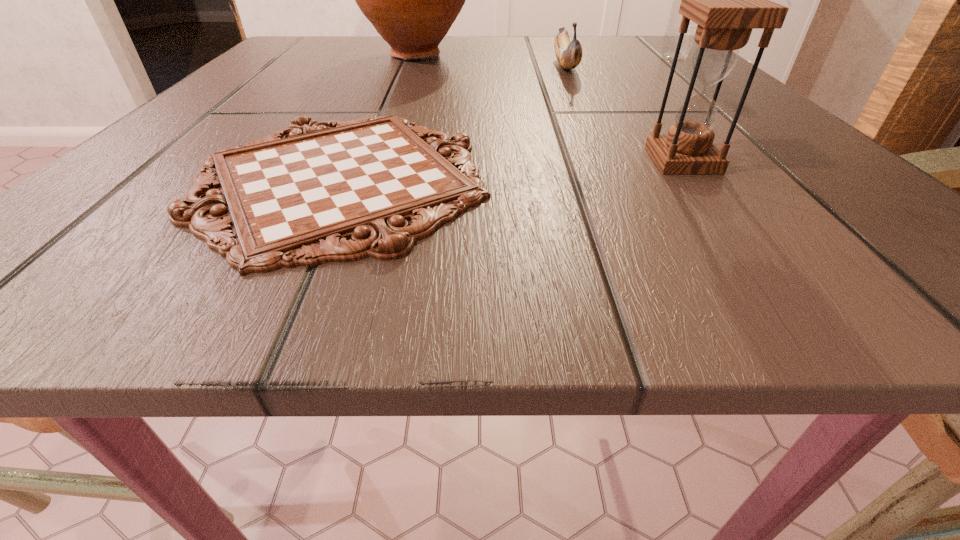
At what (x,y) coordinates should I click in order to perform the action: click on object that is positioned at the far right corner. Please return your answer as a coordinate pair (x, y). This screenshot has height=540, width=960. Looking at the image, I should click on (671, 36).

In the image, there is a desktop. Find the location of `vacant space at the far edge`. vacant space at the far edge is located at coordinates 379,39.

Where is `vacant region at the near edge of the desktop`? The image size is (960, 540). vacant region at the near edge of the desktop is located at coordinates [x=584, y=245].

The height and width of the screenshot is (540, 960). What are the coordinates of `free space at the left edge of the desktop` in the screenshot? It's located at (186, 148).

Locate an element on the screen. Image resolution: width=960 pixels, height=540 pixels. vacant point at the right edge is located at coordinates (744, 120).

The height and width of the screenshot is (540, 960). Identify the location of vacant space at the far left corner of the desktop. (295, 43).

At what (x,y) coordinates should I click in order to perform the action: click on vacant space at the near left corner of the desktop. Please return your answer as a coordinate pair (x, y). This screenshot has width=960, height=540. Looking at the image, I should click on (x=108, y=256).

Where is `free location at the far right corner`? This screenshot has height=540, width=960. free location at the far right corner is located at coordinates (659, 51).

Find the location of `free space between the third shortest object and the second shortest object`. free space between the third shortest object and the second shortest object is located at coordinates (624, 113).

In order to click on vacant area that lies between the third object from left to right and the third shortest object in this screenshot , I will do `click(624, 113)`.